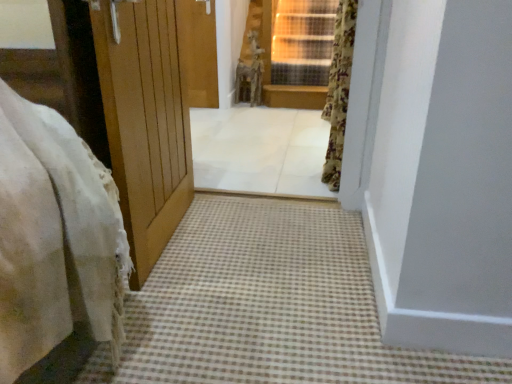
The width and height of the screenshot is (512, 384). I want to click on white tile floor at center, so click(260, 150).

Describe the element at coordinates (339, 90) in the screenshot. The height and width of the screenshot is (384, 512). I see `floral fabric curtain at upper right` at that location.

What is the approximate height of floral fabric curtain at upper right?

It is 98.00 centimeters.

What do you see at coordinates (269, 305) in the screenshot?
I see `brown checkered carpet at lower center` at bounding box center [269, 305].

Locate an element on the screen. This screenshot has height=384, width=512. white tile floor at center is located at coordinates (260, 150).

Are white tile floor at center and brown checkered carpet at lower center far apart?

Yes, white tile floor at center and brown checkered carpet at lower center are located far from each other.

How different are the orientations of white tile floor at center and brown checkered carpet at lower center in degrees?

white tile floor at center and brown checkered carpet at lower center are facing 90.2 degrees away from each other.

Between point (223, 154) and point (106, 350), which one is positioned in front?

The point (106, 350) is closer to the camera.

Measure the distance from white tile floor at center to brown checkered carpet at lower center.

white tile floor at center is 1.02 meters away from brown checkered carpet at lower center.

Is floral fabric curtain at upper right smaller than brown checkered carpet at lower center?

Yes, floral fabric curtain at upper right is smaller than brown checkered carpet at lower center.

From the image's perspective, which is above, floral fabric curtain at upper right or brown checkered carpet at lower center?

floral fabric curtain at upper right is shown above in the image.

This screenshot has width=512, height=384. I want to click on path that appears in front of the floral fabric curtain at upper right, so click(x=269, y=305).

Does point (341, 161) lie in front of point (400, 370)?

No.

Consider the image. Is floral fabric curtain at upper right closer to the viewer compared to white tile floor at center?

Yes, floral fabric curtain at upper right is in front of white tile floor at center.

Are floral fabric curtain at upper right and white tile floor at center making contact?

They are not placed beside each other.

How many degrees apart are the facing directions of floral fabric curtain at upper right and white tile floor at center?

91.9 degrees separate the facing orientations of floral fabric curtain at upper right and white tile floor at center.

Choose the correct answer: Is floral fabric curtain at upper right inside white tile floor at center or outside it?

The correct answer is: outside.

Which object is further away from the camera, white tile floor at center or floral fabric curtain at upper right?

white tile floor at center.

From their relative heights in the image, would you say white tile floor at center is taller or shorter than floral fabric curtain at upper right?

In the image, white tile floor at center appears to be shorter than floral fabric curtain at upper right.

From a real-world perspective, is white tile floor at center physically above floral fabric curtain at upper right?

No, from a real-world perspective, white tile floor at center is not on top of floral fabric curtain at upper right.

Is the surface of brown checkered carpet at lower center in direct contact with floral fabric curtain at upper right?

No.

Which is in front, point (282, 345) or point (339, 171)?

The point (282, 345) is in front.

Which object is thinner, brown checkered carpet at lower center or floral fabric curtain at upper right?

floral fabric curtain at upper right.

In the image, is brown checkered carpet at lower center positioned in front of or behind floral fabric curtain at upper right?

brown checkered carpet at lower center is in front of floral fabric curtain at upper right.

From a real-world perspective, is brown checkered carpet at lower center physically located above or below white tile floor at center?

Clearly, from a real-world perspective, brown checkered carpet at lower center is below white tile floor at center.

Is brown checkered carpet at lower center in front of or behind white tile floor at center in the image?

Visually, brown checkered carpet at lower center is located in front of white tile floor at center.

Is brown checkered carpet at lower center aimed at white tile floor at center?

No, brown checkered carpet at lower center does not turn towards white tile floor at center.

Can you confirm if brown checkered carpet at lower center is bigger than white tile floor at center?

Actually, brown checkered carpet at lower center might be smaller than white tile floor at center.

The image size is (512, 384). I want to click on passage located above the brown checkered carpet at lower center (from a real-world perspective), so click(260, 150).

You are a GUI agent. You are given a task and a screenshot of the screen. Output one action in this format:
    pyautogui.click(x=<x>, y=<y>)
    Task: Click on the curtain on the right side of brown checkered carpet at lower center
    This screenshot has width=512, height=384.
    Given the screenshot: What is the action you would take?
    pyautogui.click(x=339, y=90)

From the image, which object appears to be farther from white tile floor at center, floral fabric curtain at upper right or brown checkered carpet at lower center?

brown checkered carpet at lower center is positioned further to the anchor white tile floor at center.

Estimate the real-world distances between objects in this image. Which object is closer to floral fabric curtain at upper right, brown checkered carpet at lower center or white tile floor at center?

Based on the image, white tile floor at center appears to be nearer to floral fabric curtain at upper right.

Looking at the image, which one is located closer to floral fabric curtain at upper right, white tile floor at center or brown checkered carpet at lower center?

Based on the image, white tile floor at center appears to be nearer to floral fabric curtain at upper right.

Which object lies further to the anchor point brown checkered carpet at lower center, floral fabric curtain at upper right or white tile floor at center?

white tile floor at center is further to brown checkered carpet at lower center.

Based on their spatial positions, is brown checkered carpet at lower center or floral fabric curtain at upper right further from white tile floor at center?

brown checkered carpet at lower center is positioned further to the anchor white tile floor at center.

Consider the image. Which object lies further to the anchor point brown checkered carpet at lower center, white tile floor at center or floral fabric curtain at upper right?

white tile floor at center.

You are a GUI agent. You are given a task and a screenshot of the screen. Output one action in this format:
    pyautogui.click(x=<x>, y=<y>)
    Task: Click on the curtain between brown checkered carpet at lower center and white tile floor at center in the front-back direction
    
    Given the screenshot: What is the action you would take?
    pyautogui.click(x=339, y=90)